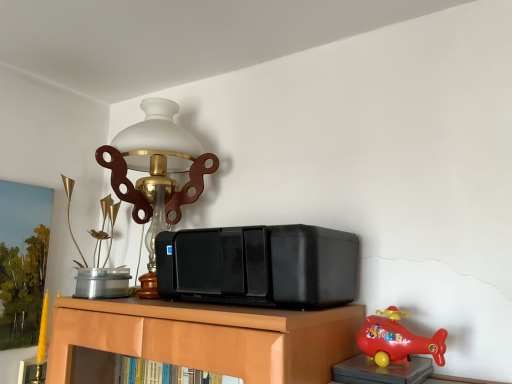
Question: Would you say black plastic stereo at center is inside or outside metallic gold vase at upper left, which is counted as the second toy, starting from the right?

Choices:
 (A) inside
 (B) outside

Answer: (B)

Question: From their relative heights in the image, would you say black plastic stereo at center is taller or shorter than metallic gold vase at upper left, which is the 1th toy in left-to-right order?

Choices:
 (A) tall
 (B) short

Answer: (B)

Question: Estimate the real-world distances between objects in this image. Which object is farther from the rubberized red helicopter at lower right, the second toy viewed from the left?

Choices:
 (A) black plastic stereo at center
 (B) metallic gold vase at upper left, which appears as the first toy when viewed from the back
 (C) matte brass lamp at upper left

Answer: (B)

Question: Considering the real-world distances, which object is farthest from the matte brass lamp at upper left?

Choices:
 (A) rubberized red helicopter at lower right, the second toy viewed from the back
 (B) black plastic stereo at center
 (C) metallic gold vase at upper left, which appears as the first toy when viewed from the back

Answer: (A)